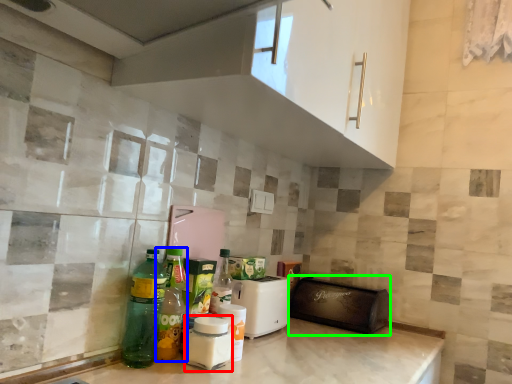
Question: Which object is the closest to the bottle (highlighted by a red box)? Choose among these: bottle (highlighted by a blue box) or appliance (highlighted by a green box).

Choices:
 (A) bottle
 (B) appliance

Answer: (A)